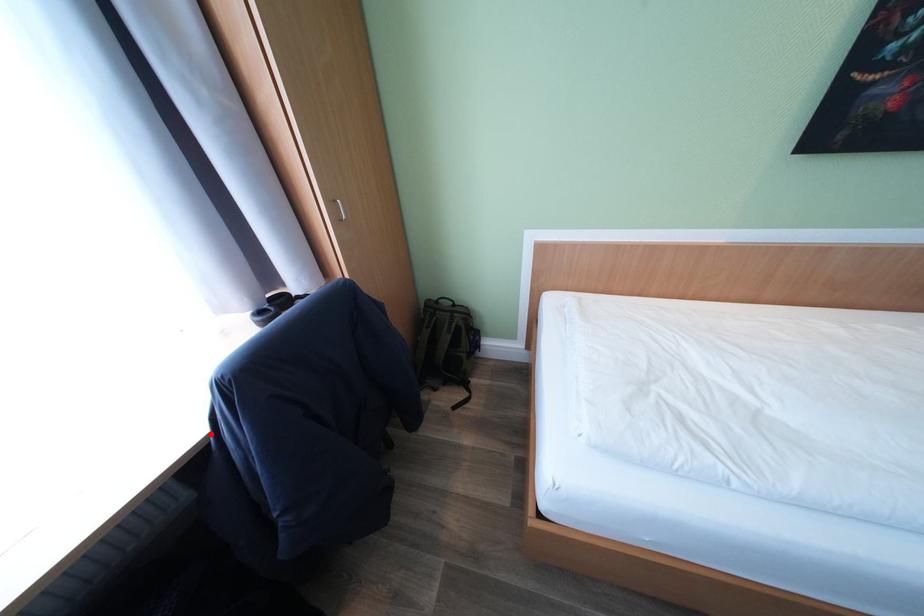
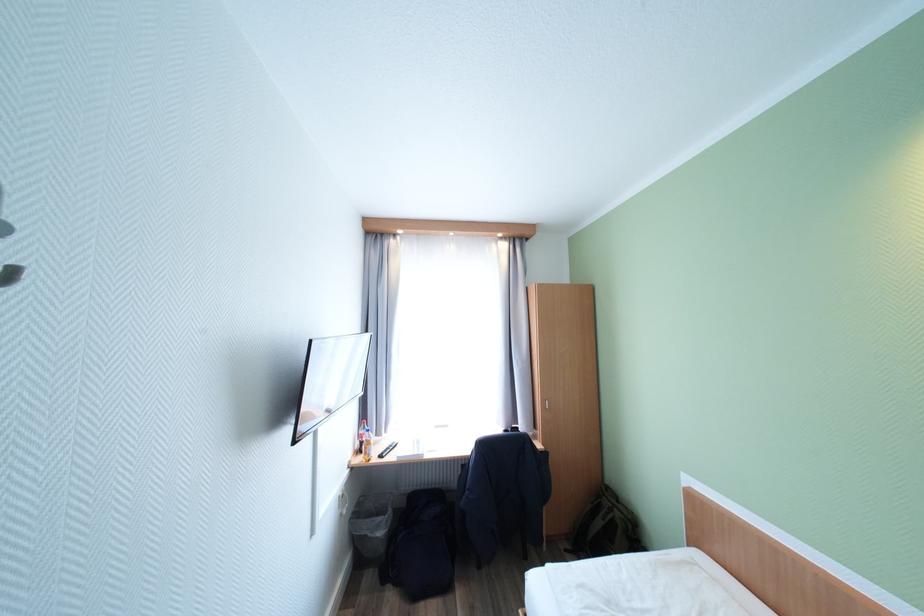
Question: I am providing you with two images of the same scene from different viewpoints. Image1 has a red point marked. In image2, the corresponding 3D location appears at what relative position? Reply with the corresponding letter.

Choices:
 (A) Closer
 (B) Farther

Answer: (B)